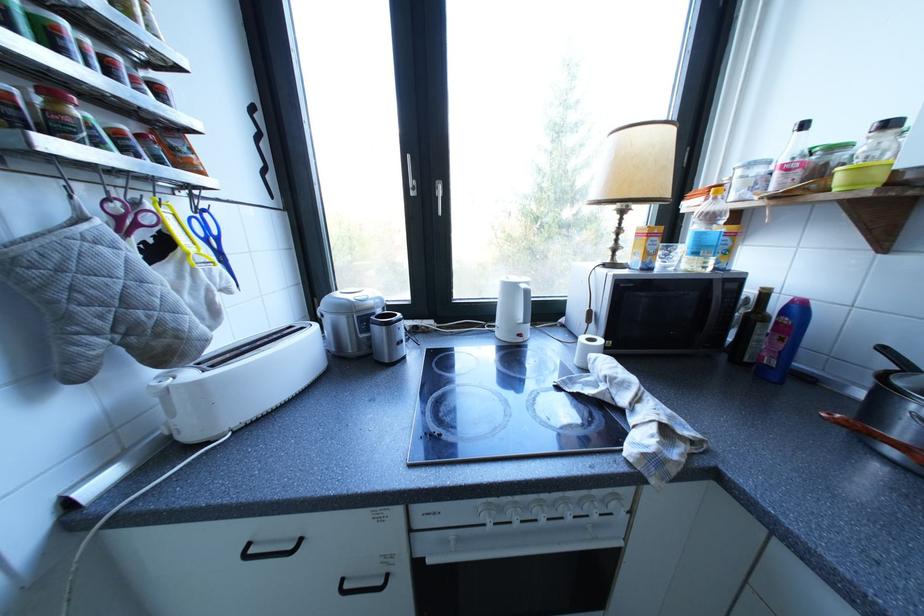
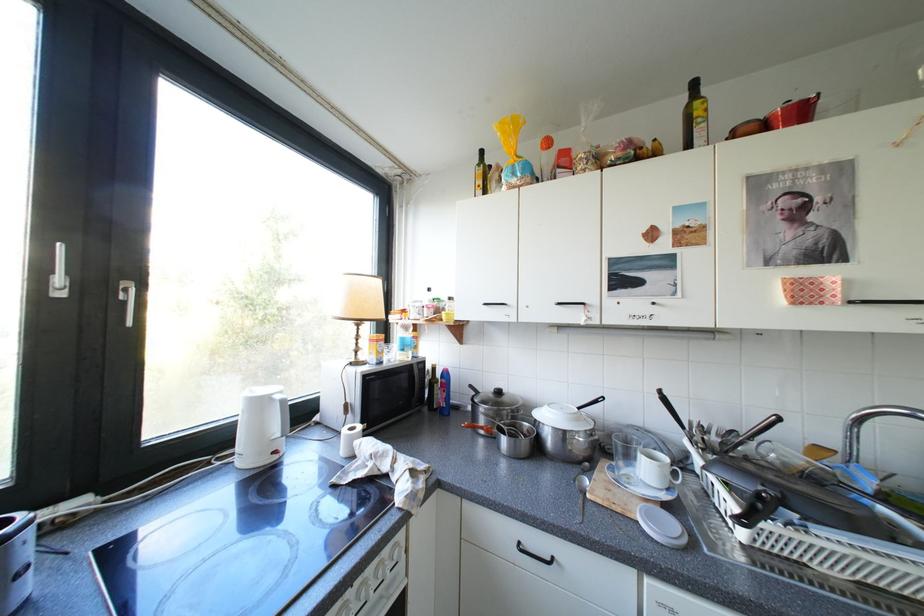
Question: The images are taken continuously from a first-person perspective. In which direction is your viewpoint rotating?

Choices:
 (A) Left
 (B) Right
 (C) Up
 (D) Down

Answer: (B)